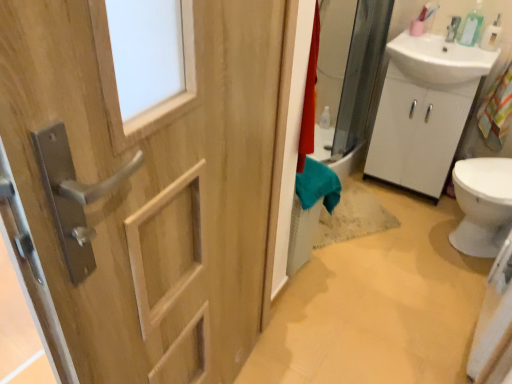
The image size is (512, 384). Find the location of `vacant area that is in front of white matte cabinet at right`. vacant area that is in front of white matte cabinet at right is located at coordinates (411, 215).